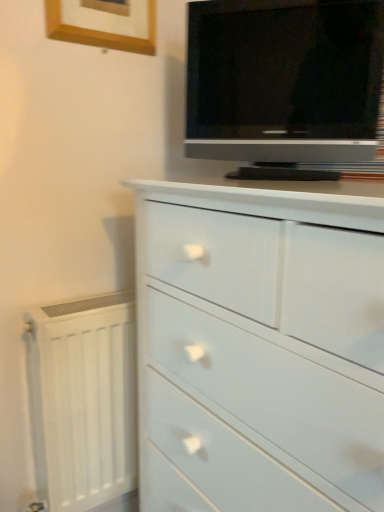
At what (x,y) coordinates should I click in order to perform the action: click on blank space above white painted radiator at lower left (from a real-world perspective). Please return your answer as a coordinate pair (x, y). The height and width of the screenshot is (512, 384). Looking at the image, I should click on (76, 304).